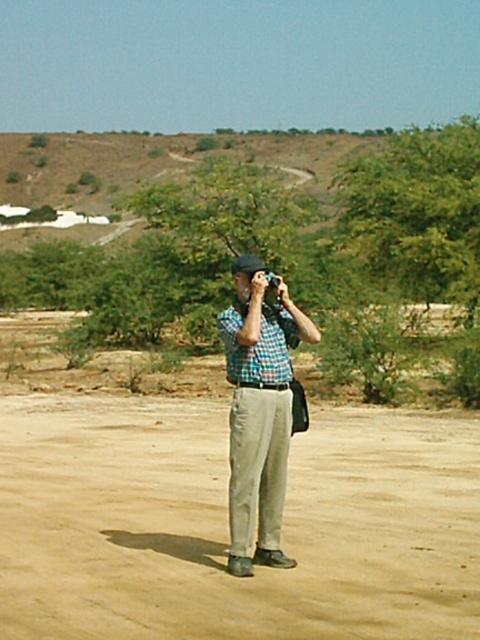
Question: Is tan sandy ground at center wider than checkered fabric shirt at center?

Choices:
 (A) yes
 (B) no

Answer: (A)

Question: Where is tan sandy ground at center located in relation to checkered fabric shirt at center in the image?

Choices:
 (A) above
 (B) below

Answer: (B)

Question: Is tan sandy ground at center above checkered fabric shirt at center?

Choices:
 (A) no
 (B) yes

Answer: (A)

Question: Which object appears farthest from the camera in this image?

Choices:
 (A) checkered fabric shirt at center
 (B) tan sandy ground at center

Answer: (A)

Question: Among these objects, which one is farthest from the camera?

Choices:
 (A) tan sandy ground at center
 (B) checkered fabric shirt at center

Answer: (B)